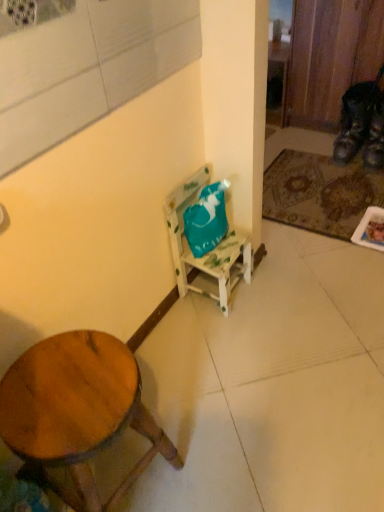
Where is `free space in front of teal fabric bag at center`? The height and width of the screenshot is (512, 384). free space in front of teal fabric bag at center is located at coordinates (225, 336).